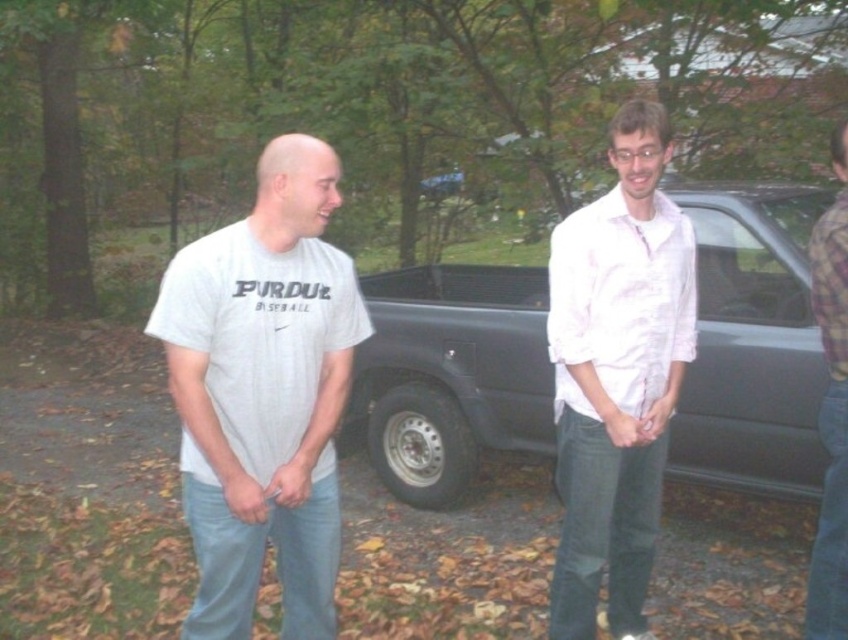
Question: Is metallic gray truck at center smaller than white cotton t-shirt at center?

Choices:
 (A) no
 (B) yes

Answer: (A)

Question: Is white cotton t-shirt at center closer to camera compared to plaid flannel shirt at right?

Choices:
 (A) yes
 (B) no

Answer: (A)

Question: Among these points, which one is farthest from the camera?

Choices:
 (A) (244, 484)
 (B) (671, 214)

Answer: (B)

Question: Does metallic gray truck at center appear on the right side of plaid flannel shirt at right?

Choices:
 (A) yes
 (B) no

Answer: (B)

Question: Among these points, which one is farthest from the camera?

Choices:
 (A) (297, 472)
 (B) (807, 602)
 (C) (650, 440)
 (D) (410, 420)

Answer: (D)

Question: Which point is farther to the camera?

Choices:
 (A) white cotton shirt at center
 (B) white cotton t-shirt at center
 (C) metallic gray truck at center
 (D) plaid flannel shirt at right

Answer: (C)